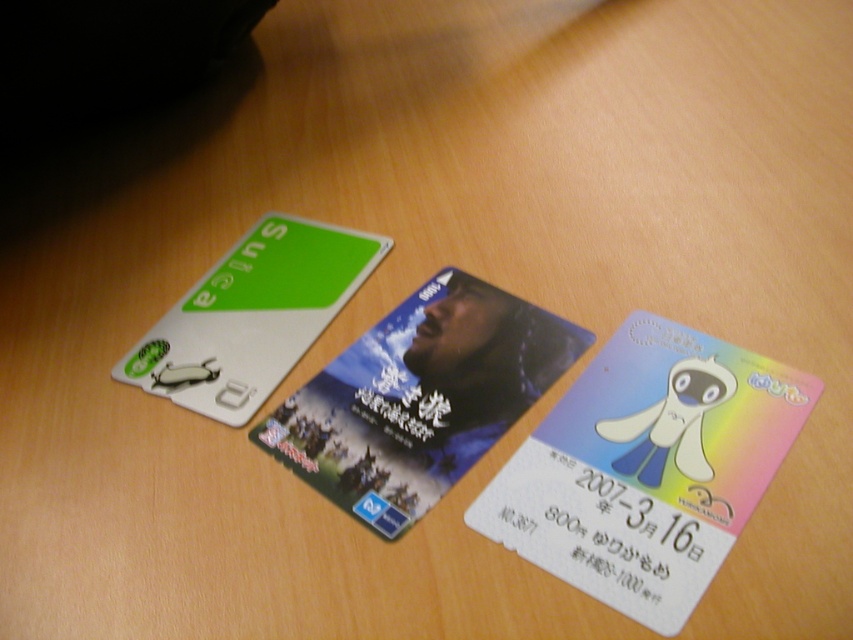
Question: Is pastel rainbow card at center closer to camera compared to green matte suica card at upper left?

Choices:
 (A) yes
 (B) no

Answer: (A)

Question: Estimate the real-world distances between objects in this image. Which object is closer to the green matte suica card at upper left?

Choices:
 (A) matte plastic card at center
 (B) pastel rainbow card at center

Answer: (A)

Question: Which object is closer to the camera taking this photo?

Choices:
 (A) green matte suica card at upper left
 (B) pastel rainbow card at center
 (C) matte plastic card at center

Answer: (B)

Question: Is pastel rainbow card at center positioned in front of matte plastic card at center?

Choices:
 (A) yes
 (B) no

Answer: (A)

Question: Which of the following is the farthest from the observer?

Choices:
 (A) pastel rainbow card at center
 (B) green matte suica card at upper left

Answer: (B)

Question: Observing the image, what is the correct spatial positioning of pastel rainbow card at center in reference to matte plastic card at center?

Choices:
 (A) right
 (B) left

Answer: (A)